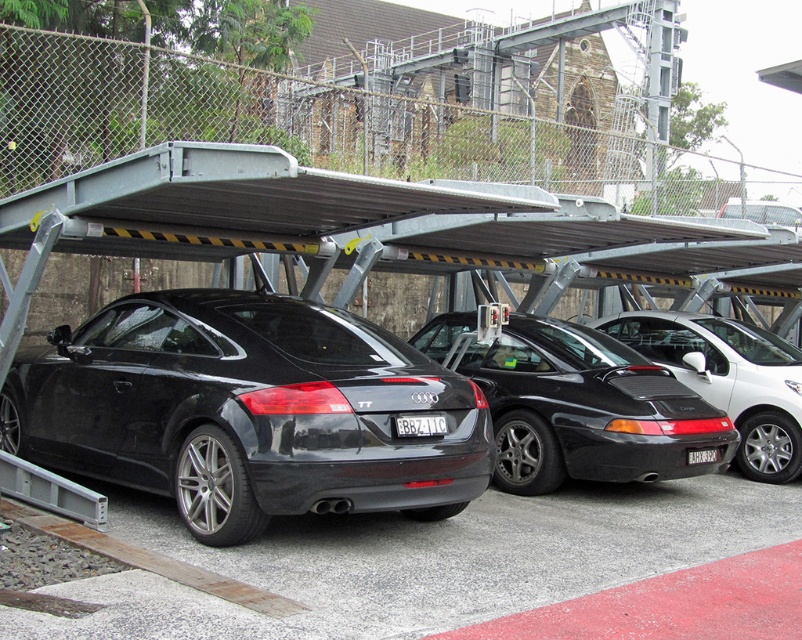
Who is positioned more to the right, black matte sports car at center or white plastic license plate at center?

From the viewer's perspective, black matte sports car at center appears more on the right side.

Is black matte sports car at center to the right of white plastic license plate at center from the viewer's perspective?

Indeed, black matte sports car at center is positioned on the right side of white plastic license plate at center.

Is point (735, 417) positioned after point (401, 420)?

Yes, point (735, 417) is behind point (401, 420).

Find the location of a particular element. black matte sports car at center is located at coordinates (728, 380).

Image resolution: width=802 pixels, height=640 pixels. I want to click on black matte car at center, so click(x=586, y=410).

Which is below, black matte car at center or black matte sports car at center?

Positioned lower is black matte car at center.

Is point (705, 468) farther from camera compared to point (715, 380)?

That is False.

This screenshot has width=802, height=640. Find the location of `black matte car at center`. black matte car at center is located at coordinates (586, 410).

Which of these two, glossy black car at center or black matte car at center, stands shorter?

black matte car at center is shorter.

Does glossy black car at center have a greater width compared to black matte car at center?

Indeed, glossy black car at center has a greater width compared to black matte car at center.

Between point (369, 332) and point (537, 369), which one is positioned in front?

Point (369, 332) is more forward.

In order to click on glossy black car at center in this screenshot , I will do `click(246, 410)`.